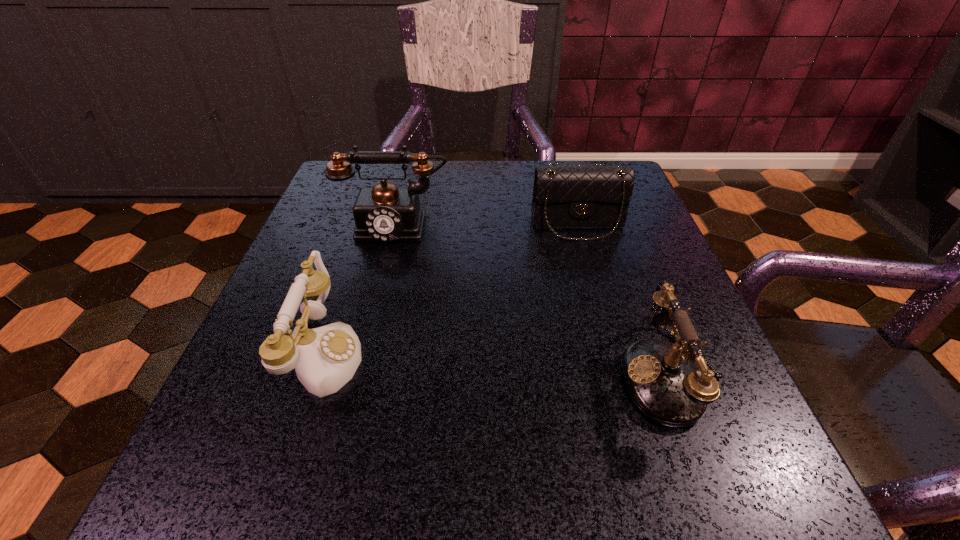
What are the coordinates of `free region at the right edge of the desktop` in the screenshot? It's located at (592, 292).

In the image, there is a desktop. Identify the location of free space at the near left corner. This screenshot has height=540, width=960. (245, 459).

Image resolution: width=960 pixels, height=540 pixels. In the image, there is a desktop. Identify the location of vacant space at the near right corner. (710, 494).

Find the location of `vacant space that is in between the tallest telephone and the rightmost telephone`. vacant space that is in between the tallest telephone and the rightmost telephone is located at coordinates (533, 301).

At what (x,y) coordinates should I click in order to perform the action: click on vacant space in between the clutch bag and the rightmost telephone. Please return your answer as a coordinate pair (x, y). The image size is (960, 540). Looking at the image, I should click on (624, 300).

Locate an element on the screen. Image resolution: width=960 pixels, height=540 pixels. empty space that is in between the tallest telephone and the clutch bag is located at coordinates (487, 225).

Identify the location of vacant area that lies between the rightmost telephone and the tallest telephone. Image resolution: width=960 pixels, height=540 pixels. (533, 301).

The image size is (960, 540). Identify the location of free space between the rightmost telephone and the tallest telephone. (533, 301).

You are a GUI agent. You are given a task and a screenshot of the screen. Output one action in this format:
    pyautogui.click(x=<x>, y=<y>)
    Task: Click on the free space between the farthest telephone and the rightmost telephone
    Image resolution: width=960 pixels, height=540 pixels.
    Given the screenshot: What is the action you would take?
    pyautogui.click(x=533, y=301)

Find the location of a particular element. This screenshot has width=960, height=540. empty space between the rightmost telephone and the tallest object is located at coordinates (533, 301).